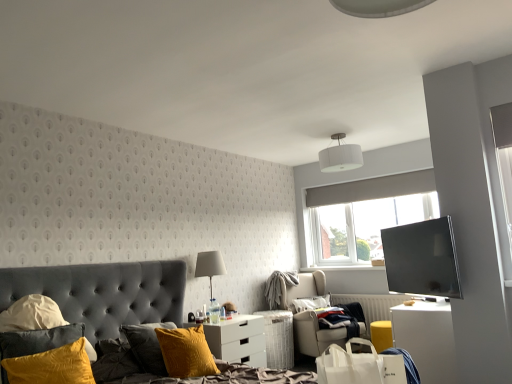
At what (x,y) coordinates should I click in order to perform the action: click on matte white lampshade at center, positioned as the 2th lamp in top-to-bottom order. Please return your answer as a coordinate pair (x, y). Image resolution: width=512 pixels, height=384 pixels. Looking at the image, I should click on (210, 266).

What do you see at coordinates (210, 266) in the screenshot?
I see `matte white lampshade at center, the 1th lamp from the left` at bounding box center [210, 266].

Find the location of a particular element. The image size is (512, 384). translucent glass bottle at center is located at coordinates (214, 311).

The width and height of the screenshot is (512, 384). Describe the element at coordinates (310, 303) in the screenshot. I see `white soft pillow at center, arranged as the third pillow when viewed from the front` at that location.

Measure the distance between point (x=164, y=284) and camera.

The distance of point (x=164, y=284) from camera is 3.89 meters.

Describe the element at coordinates (422, 258) in the screenshot. I see `matte black tv at right` at that location.

Locate an element on the screen. white matte shopping bag at lower right is located at coordinates (359, 365).

At what (x,y) coordinates should I click in order to perform the action: click on bottle behind the velvet yellow pillow at left, placed as the third pillow when sorted from right to left. Please return your answer as a coordinate pair (x, y). The height and width of the screenshot is (384, 512). Looking at the image, I should click on (214, 311).

Is velvet yellow pillow at left, placed as the third pillow when sorted from right to left, inside translucent glass bottle at center?

Actually, velvet yellow pillow at left, placed as the third pillow when sorted from right to left, is outside translucent glass bottle at center.

Between translucent glass bottle at center and velvet yellow pillow at left, which is the 1th pillow from left to right, which one has larger size?

Bigger between the two is velvet yellow pillow at left, which is the 1th pillow from left to right.

Does matte black tv at right appear on the right side of white glossy desk at lower right?

No, matte black tv at right is not to the right of white glossy desk at lower right.

In order to click on television in front of the white glossy desk at lower right in this screenshot , I will do `click(422, 258)`.

Considering their positions, is white soft pillow at center, which is counted as the 3th pillow, starting from the left, located in front of or behind velvet grey bed at lower left?

Clearly, white soft pillow at center, which is counted as the 3th pillow, starting from the left, is behind velvet grey bed at lower left.

Can you tell me how much white soft pillow at center, which is the first pillow from back to front, and velvet grey bed at lower left differ in facing direction?

There is a 39.5-degree angle between the facing directions of white soft pillow at center, which is the first pillow from back to front, and velvet grey bed at lower left.

Would you say white soft pillow at center, which is the first pillow from back to front, contains velvet grey bed at lower left?

No, velvet grey bed at lower left is not surrounded by white soft pillow at center, which is the first pillow from back to front.

From the image's perspective, does white glossy nightstand at lower center appear lower than translucent glass bottle at center?

Yes.

Is white glossy nightstand at lower center far away from translucent glass bottle at center?

They are positioned close to each other.

What's the angular difference between white glossy nightstand at lower center and translucent glass bottle at center's facing directions?

white glossy nightstand at lower center and translucent glass bottle at center are facing 1.05 degrees away from each other.

Is beige fabric chair at center oriented towards white glossy desk at lower right?

Yes, beige fabric chair at center is aimed at white glossy desk at lower right.

Consider the image. Which is more to the left, beige fabric chair at center or white glossy desk at lower right?

beige fabric chair at center is more to the left.

Between beige fabric chair at center and white glossy desk at lower right, which one is positioned behind?

beige fabric chair at center is further away from the camera.

Which object is thinner, beige fabric chair at center or white glossy desk at lower right?

white glossy desk at lower right is thinner.

From the image's perspective, is velvet yellow pillow at left, placed as the third pillow when sorted from right to left, under white glossy nightstand at lower center?

Incorrect, from the image's perspective, velvet yellow pillow at left, placed as the third pillow when sorted from right to left, is higher than white glossy nightstand at lower center.

Is velvet yellow pillow at left, placed as the third pillow when sorted from right to left, inside the boundaries of white glossy nightstand at lower center, or outside?

velvet yellow pillow at left, placed as the third pillow when sorted from right to left, is not enclosed by white glossy nightstand at lower center.

Consider the image. From a real-world perspective, which object rests below the other?

white glossy nightstand at lower center, from a real-world perspective.

Considering the sizes of objects white fabric lampshade at upper center, acting as the second lamp starting from the left, and matte black tv at right in the image provided, who is smaller, white fabric lampshade at upper center, acting as the second lamp starting from the left, or matte black tv at right?

Smaller between the two is matte black tv at right.

Is white fabric lampshade at upper center, which appears as the second lamp when ordered from the bottom, positioned far away from matte black tv at right?

Absolutely, white fabric lampshade at upper center, which appears as the second lamp when ordered from the bottom, is distant from matte black tv at right.

Visually, is white fabric lampshade at upper center, which appears as the second lamp when ordered from the bottom, positioned to the left or to the right of matte black tv at right?

In the image, white fabric lampshade at upper center, which appears as the second lamp when ordered from the bottom, appears on the left side of matte black tv at right.

The height and width of the screenshot is (384, 512). What are the coordinates of `the 2nd pillow to the left of the translucent glass bottle at center, counting from the anchor's position` in the screenshot? It's located at (32, 314).

You are a GUI agent. You are given a task and a screenshot of the screen. Output one action in this format:
    pyautogui.click(x=<x>, y=<y>)
    Task: Click on the desk behind the matte black tv at right
    
    Given the screenshot: What is the action you would take?
    pyautogui.click(x=426, y=338)

Estimate the real-world distances between objects in this image. Which object is closer to velvet yellow pillow at left, which appears as the 2th pillow when viewed from the back, velvet yellow pillow at lower left, marked as the 2th pillow in a right-to-left arrangement, or translucent glass bottle at center?

The object closer to velvet yellow pillow at left, which appears as the 2th pillow when viewed from the back, is velvet yellow pillow at lower left, marked as the 2th pillow in a right-to-left arrangement.

Which object lies nearer to the anchor point white glossy desk at lower right, beige fabric chair at center or velvet grey bed at lower left?

beige fabric chair at center is closer to white glossy desk at lower right.

Which object lies nearer to the anchor point beige fabric chair at center, white glossy nightstand at lower center or white glossy desk at lower right?

white glossy nightstand at lower center lies closer to beige fabric chair at center than the other object.

Estimate the real-world distances between objects in this image. Which object is further from beige fabric chair at center, matte white lampshade at center, the 1th lamp from the left, or white glossy desk at lower right?

white glossy desk at lower right.

Based on their spatial positions, is white soft pillow at center, which is the first pillow from back to front, or white fabric lampshade at upper center, which appears as the second lamp when ordered from the bottom, closer to velvet yellow pillow at left, which appears as the 2th pillow when viewed from the back?

Based on the image, white soft pillow at center, which is the first pillow from back to front, appears to be nearer to velvet yellow pillow at left, which appears as the 2th pillow when viewed from the back.

From the image, which object appears to be farther from beige fabric chair at center, white glossy nightstand at lower center or velvet grey bed at lower left?

velvet grey bed at lower left is positioned further to the anchor beige fabric chair at center.

Based on their spatial positions, is velvet grey bed at lower left or white glossy desk at lower right further from white glossy nightstand at lower center?

Based on the image, white glossy desk at lower right appears to be further to white glossy nightstand at lower center.

Based on the photo, when comparing their distances from velvet grey bed at lower left, does matte white lampshade at center, the second lamp viewed from the right, or white glossy nightstand at lower center seem closer?

white glossy nightstand at lower center.

In order to click on pillow between velvet yellow pillow at lower left, the 2th pillow in the left-to-right sequence, and matte white lampshade at center, the first lamp in the bottom-to-top sequence, along the z-axis in this screenshot , I will do `click(32, 314)`.

Find the location of a particular element. The width and height of the screenshot is (512, 384). chair positioned between velvet grey bed at lower left and white soft pillow at center, arranged as the third pillow when viewed from the front, from near to far is located at coordinates (314, 335).

Identify the location of television between matte white lampshade at center, positioned as the 2th lamp in top-to-bottom order, and white glossy desk at lower right, in the horizontal direction. (422, 258).

Find the location of a particular element. This screenshot has width=512, height=384. television between white matte shopping bag at lower right and translucent glass bottle at center from front to back is located at coordinates (422, 258).